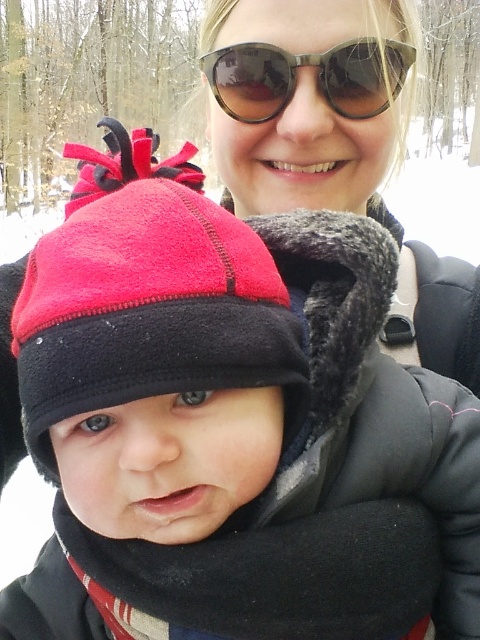
Who is positioned more to the right, red fleece hat at center or sunglasses at upper center?

Positioned to the right is sunglasses at upper center.

Who is taller, red fleece hat at center or sunglasses at upper center?

Standing taller between the two is red fleece hat at center.

The height and width of the screenshot is (640, 480). Find the location of `red fleece hat at center`. red fleece hat at center is located at coordinates (146, 296).

Is point (120, 301) positioned behind point (376, 74)?

No.

Is red fleece hat at center smaller than matte black sunglasses at upper center?

Incorrect, red fleece hat at center is not smaller in size than matte black sunglasses at upper center.

Which is behind, point (81, 352) or point (328, 173)?

The point (328, 173) is more distant.

Locate an element on the screen. This screenshot has width=480, height=640. red fleece hat at center is located at coordinates (146, 296).

Does matte black sunglasses at upper center appear under sunglasses at upper center?

Indeed, matte black sunglasses at upper center is positioned under sunglasses at upper center.

Can you confirm if matte black sunglasses at upper center is positioned to the right of sunglasses at upper center?

Correct, you'll find matte black sunglasses at upper center to the right of sunglasses at upper center.

Where is `matte black sunglasses at upper center`? The width and height of the screenshot is (480, 640). matte black sunglasses at upper center is located at coordinates (307, 100).